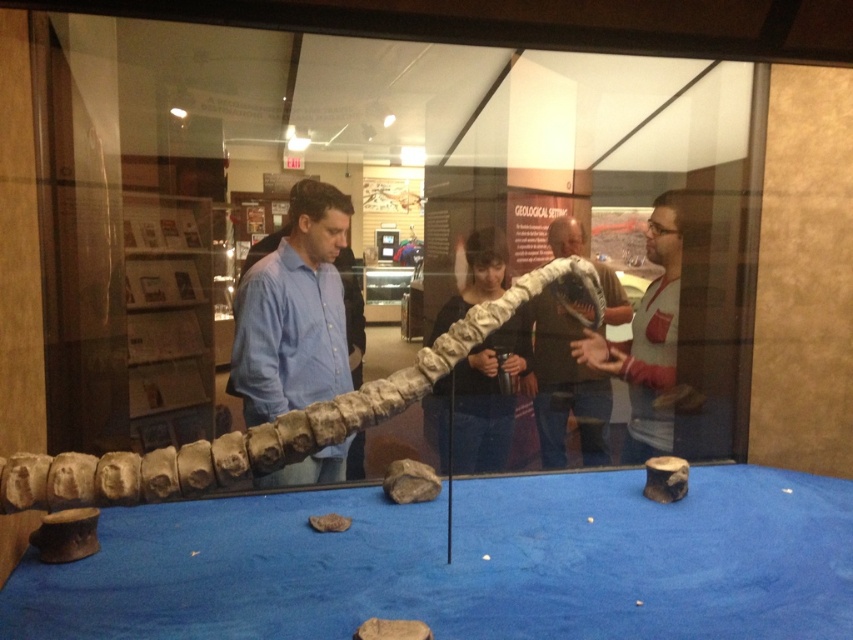
Who is more forward, (309, 314) or (477, 419)?

Positioned in front is point (309, 314).

Does matte blue shirt at center have a larger size compared to matte white dinosaur bone at center?

No, matte blue shirt at center is not bigger than matte white dinosaur bone at center.

Is point (283, 243) closer to camera compared to point (473, 346)?

That is False.

The height and width of the screenshot is (640, 853). Identify the location of matte blue shirt at center. (294, 310).

Identify the location of matte white dinosaur bone at center. (480, 401).

Which is more to the left, matte white dinosaur bone at center or matte gray dinosaur at center?

Positioned to the left is matte white dinosaur bone at center.

Does point (460, 380) come behind point (602, 448)?

Yes, point (460, 380) is behind point (602, 448).

The height and width of the screenshot is (640, 853). Find the location of `matte white dinosaur bone at center`. matte white dinosaur bone at center is located at coordinates (480, 401).

Does matte blue shirt at center have a larger size compared to matte gray dinosaur at center?

Correct, matte blue shirt at center is larger in size than matte gray dinosaur at center.

Who is shorter, matte blue shirt at center or matte gray dinosaur at center?

matte blue shirt at center

Does point (311, 227) lie behind point (576, 362)?

That is False.

In order to click on matte blue shirt at center in this screenshot , I will do pyautogui.click(x=294, y=310).